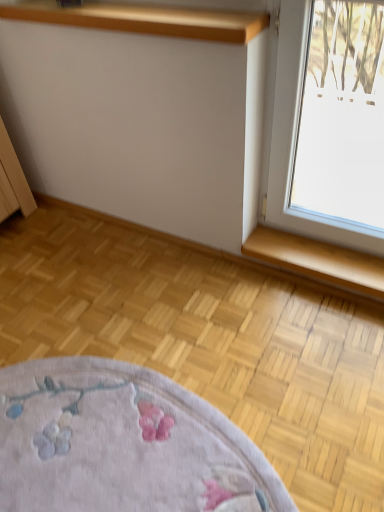
Describe the element at coordinates (318, 260) in the screenshot. This screenshot has height=512, width=384. I see `wooden at lower right` at that location.

Locate an element on the screen. The height and width of the screenshot is (512, 384). wooden at lower right is located at coordinates (318, 260).

Identify the location of wooden shelf at upper center. (143, 19).

Measure the distance between point (135, 21) and camera.

Point (135, 21) and camera are 1.26 meters apart.

What is the approximate height of wooden shelf at upper center?

The height of wooden shelf at upper center is 2.35 inches.

This screenshot has height=512, width=384. What do you see at coordinates (143, 19) in the screenshot?
I see `wooden shelf at upper center` at bounding box center [143, 19].

Image resolution: width=384 pixels, height=512 pixels. I want to click on wooden at lower right, so click(318, 260).

Is wooden shelf at upper center at the right side of wooden at lower right?

Incorrect, wooden shelf at upper center is not on the right side of wooden at lower right.

Which object is further away from the camera taking this photo, wooden shelf at upper center or wooden at lower right?

wooden at lower right is behind.

Does point (0, 11) appear closer or farther from the camera than point (328, 262)?

Point (0, 11) appears to be closer to the viewer than point (328, 262).

From the image's perspective, between wooden shelf at upper center and wooden at lower right, who is located below?

wooden at lower right appears lower in the image.

Based on the photo, from a real-world perspective, is wooden shelf at upper center above or below wooden at lower right?

From a real-world perspective, wooden shelf at upper center is physically above wooden at lower right.

Looking at this image, which object is wider, wooden shelf at upper center or wooden at lower right?

With larger width is wooden shelf at upper center.

Does wooden shelf at upper center have a lesser height compared to wooden at lower right?

Yes.

Is wooden shelf at upper center smaller than wooden at lower right?

No.

Do you think wooden shelf at upper center is within wooden at lower right, or outside of it?

wooden shelf at upper center is located beyond the bounds of wooden at lower right.

Is wooden shelf at upper center with wooden at lower right?

No, wooden shelf at upper center is not with wooden at lower right.

Is wooden shelf at upper center facing towards wooden at lower right?

No, wooden shelf at upper center is not facing towards wooden at lower right.

How many degrees apart are the facing directions of wooden shelf at upper center and wooden at lower right?

They differ by 0.000397 degrees in their facing directions.

Where is `shelf in front of the wooden at lower right`? shelf in front of the wooden at lower right is located at coordinates (143, 19).

Based on their positions, is wooden at lower right located to the left or right of wooden shelf at upper center?

Based on their positions, wooden at lower right is located to the right of wooden shelf at upper center.

In the image, is wooden at lower right positioned in front of or behind wooden shelf at upper center?

Visually, wooden at lower right is located behind wooden shelf at upper center.

Does point (306, 265) come farther from viewer compared to point (120, 11)?

Yes.

From the image's perspective, which is below, wooden at lower right or wooden shelf at upper center?

wooden at lower right.

From a real-world perspective, is wooden at lower right positioned under wooden shelf at upper center based on gravity?

Yes, from a real-world perspective, wooden at lower right is below wooden shelf at upper center.

Considering the sizes of objects wooden at lower right and wooden shelf at upper center in the image provided, who is wider, wooden at lower right or wooden shelf at upper center?

Wider between the two is wooden shelf at upper center.

Is wooden at lower right shorter than wooden shelf at upper center?

Incorrect, the height of wooden at lower right does not fall short of that of wooden shelf at upper center.

Between wooden at lower right and wooden shelf at upper center, which one has smaller size?

Smaller between the two is wooden at lower right.

Is wooden shelf at upper center inside wooden at lower right?

Actually, wooden shelf at upper center is outside wooden at lower right.

Is wooden at lower right next to wooden shelf at upper center?

wooden at lower right is not next to wooden shelf at upper center, and they're not touching.

Is wooden at lower right turned away from wooden shelf at upper center?

wooden at lower right is not turned away from wooden shelf at upper center.

How distant is wooden at lower right from wooden shelf at upper center?

wooden at lower right is 33.20 inches away from wooden shelf at upper center.

At what (x,y) coordinates should I click in order to perform the action: click on window sill on the right of wooden shelf at upper center. Please return your answer as a coordinate pair (x, y). The image size is (384, 512). Looking at the image, I should click on (318, 260).

At what (x,y) coordinates should I click in order to perform the action: click on shelf located on the left of wooden at lower right. Please return your answer as a coordinate pair (x, y). Image resolution: width=384 pixels, height=512 pixels. Looking at the image, I should click on (143, 19).

Find the location of a particular element. shelf above the wooden at lower right (from a real-world perspective) is located at coordinates (143, 19).